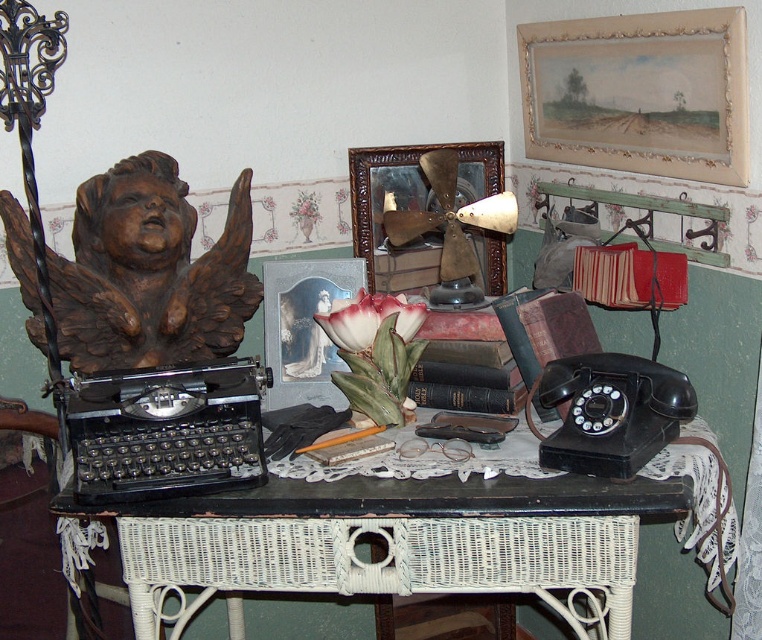
You are organizing a display on the desk and need to place both the black painted wood table at center and the watercolor paper painting at upper right. Based on their sizes, which object should you consider placing first to ensure there is enough space?

The black painted wood table at center might be wider than the watercolor paper painting at upper right, so you should place the larger one first to accommodate its size.

You are organizing items on the desk and need to place a new item between the black painted wood table at center and the metallic silver picture frame at center. Based on their positions, where should you place the new item?

Since the black painted wood table at center is in front of the metallic silver picture frame at center, you should place the new item between them by positioning it in front of the metallic silver picture frame at center and behind the black painted wood table at center.